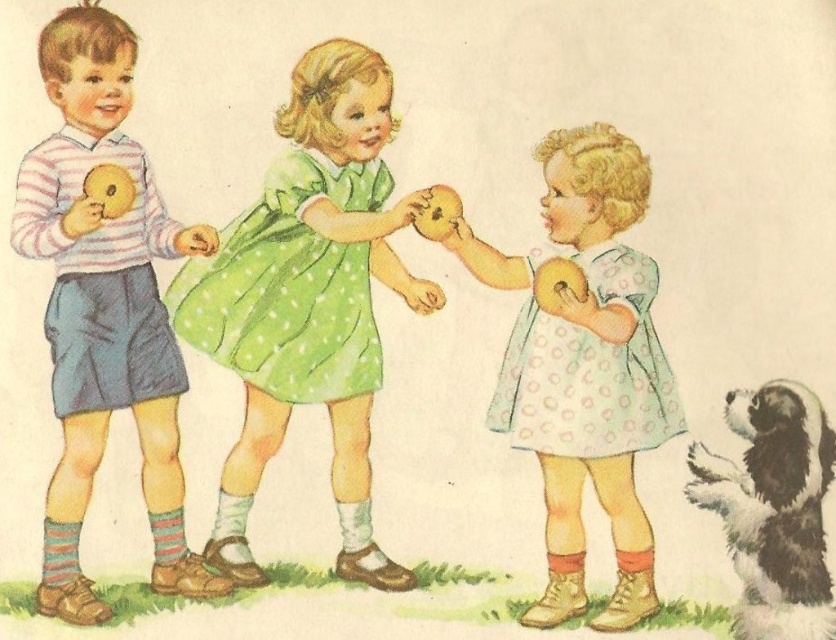
Is matte striped sweater at left to the left of matte yellow doll at left from the viewer's perspective?

Incorrect, matte striped sweater at left is not on the left side of matte yellow doll at left.

Does matte striped sweater at left have a greater height compared to matte yellow doll at left?

Yes.

Which is in front, point (151, 280) or point (83, 193)?

Point (83, 193) is in front.

The width and height of the screenshot is (836, 640). I want to click on matte striped sweater at left, so click(x=104, y=308).

Looking at this image, between pastel dotted dress at center and matte yellow doll at left, which one is positioned higher?

matte yellow doll at left is higher up.

In the scene shown: Is pastel dotted dress at center closer to the viewer compared to matte yellow doll at left?

Yes, pastel dotted dress at center is closer to the viewer.

What do you see at coordinates (590, 376) in the screenshot?
I see `pastel dotted dress at center` at bounding box center [590, 376].

Locate an element on the screen. The height and width of the screenshot is (640, 836). pastel dotted dress at center is located at coordinates (590, 376).

Is green polka dot dress at center to the right of black and white fur dog at lower right from the viewer's perspective?

Incorrect, green polka dot dress at center is not on the right side of black and white fur dog at lower right.

Which is behind, point (256, 296) or point (753, 525)?

Positioned behind is point (256, 296).

Image resolution: width=836 pixels, height=640 pixels. Find the location of `green polka dot dress at center`. green polka dot dress at center is located at coordinates (308, 300).